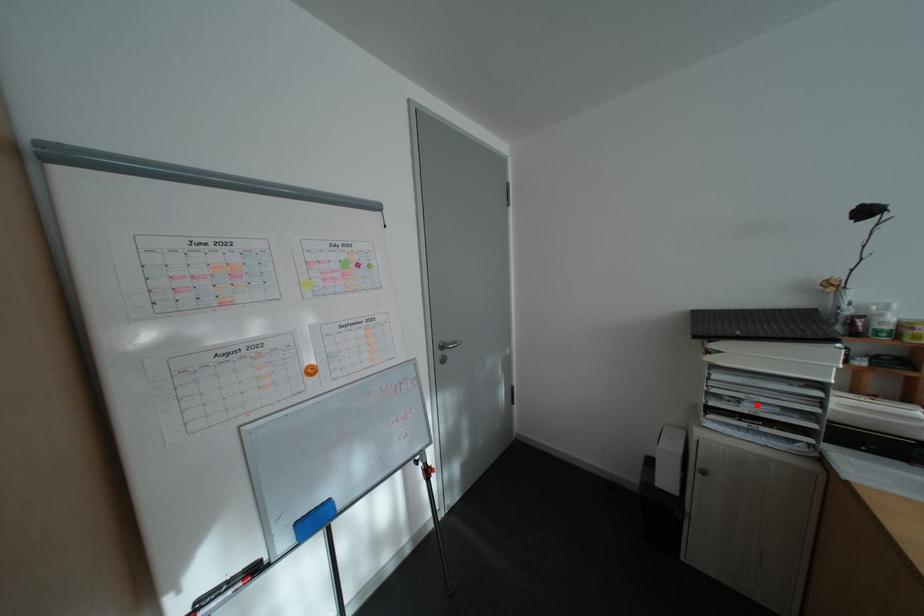
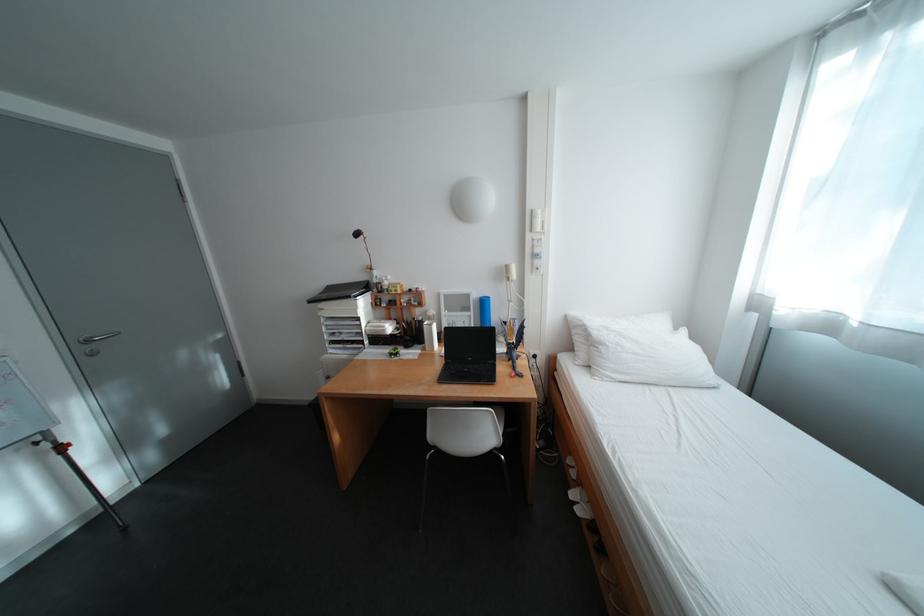
The point at the highlighted location is marked in the first image. Where is the corresponding point in the second image?

(355, 336)